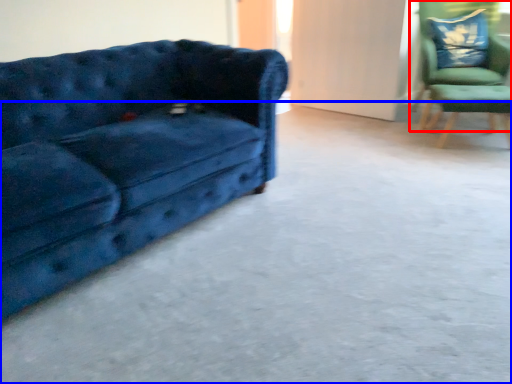
Question: Among these objects, which one is nearest to the camera, chair (highlighted by a red box) or concrete (highlighted by a blue box)?

Choices:
 (A) chair
 (B) concrete

Answer: (B)